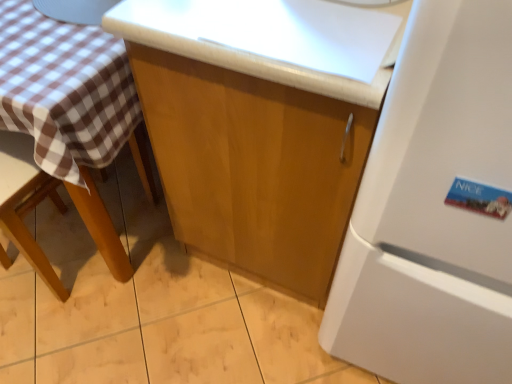
Image resolution: width=512 pixels, height=384 pixels. What are the coordinates of `vacant space underneath brown wooden chair at left (from a real-world perspective)` in the screenshot? It's located at (65, 250).